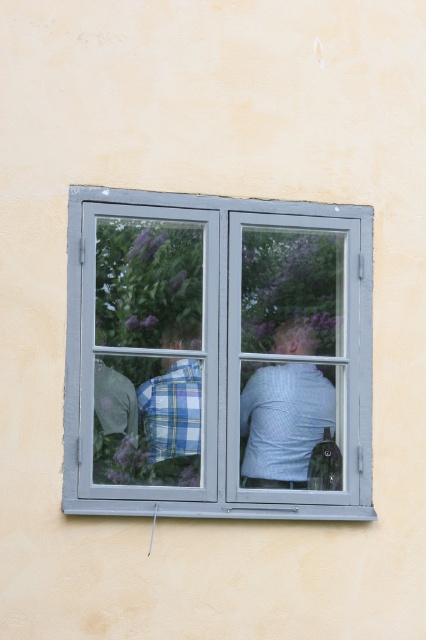
You are standing in a room with a window. You see a point marked at coordinates (284, 422). What is the object located at that point?

The point at coordinates (284, 422) corresponds to the light blue checkered shirt at center.

You are standing in a room with a window that has two people wearing shirts in the center. The shirts are a light blue checkered shirt at center and a plaid shirt at center. If the window frame is 1 meter wide, can both shirts fit within the window frame without overlapping?

The light blue checkered shirt at center might be wider than plaid shirt at center, but since their combined widths are unknown, it is uncertain if both can fit within the 1 meter window frame without overlapping.